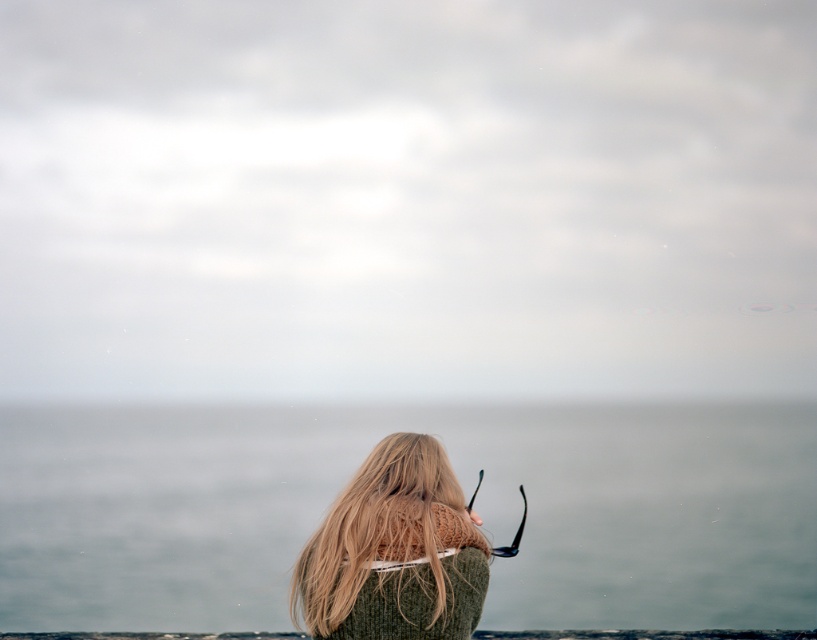
You are a photographer trying to capture the perfect shot of the person sitting by the sea. You notice two points of interest in your viewfinder at coordinates point (x=257, y=580) and point (x=467, y=570). Which point is closer to the camera and should you focus on first?

Point (x=257, y=580) is closer to the camera than point (x=467, y=570), so you should focus on point (x=257, y=580) first.